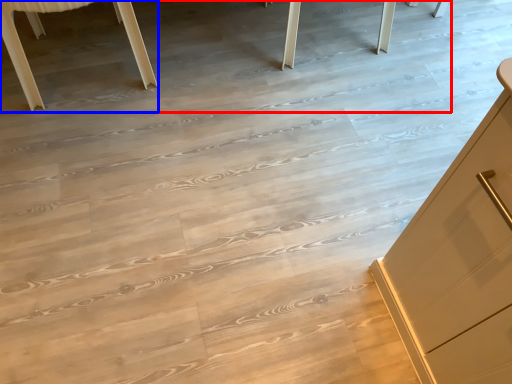
Question: Which of the following is the closest to the observer, table (highlighted by a red box) or furniture (highlighted by a blue box)?

Choices:
 (A) table
 (B) furniture

Answer: (B)